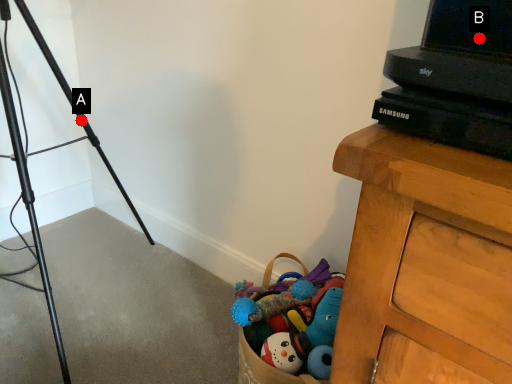
Question: Two points are circled on the image, labeled by A and B beside each circle. Which point is further to the camera?

Choices:
 (A) A is further
 (B) B is further

Answer: (A)